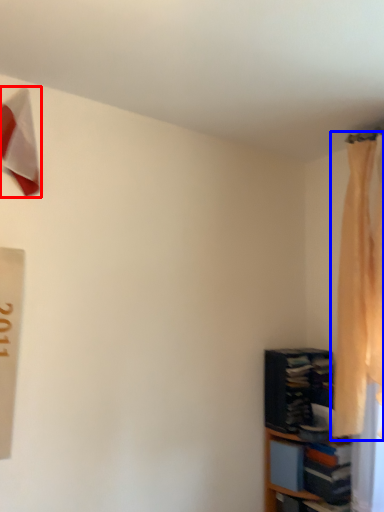
Question: Which of the following is the farthest to the observer, twin (highlighted by a red box) or curtain (highlighted by a blue box)?

Choices:
 (A) twin
 (B) curtain

Answer: (B)